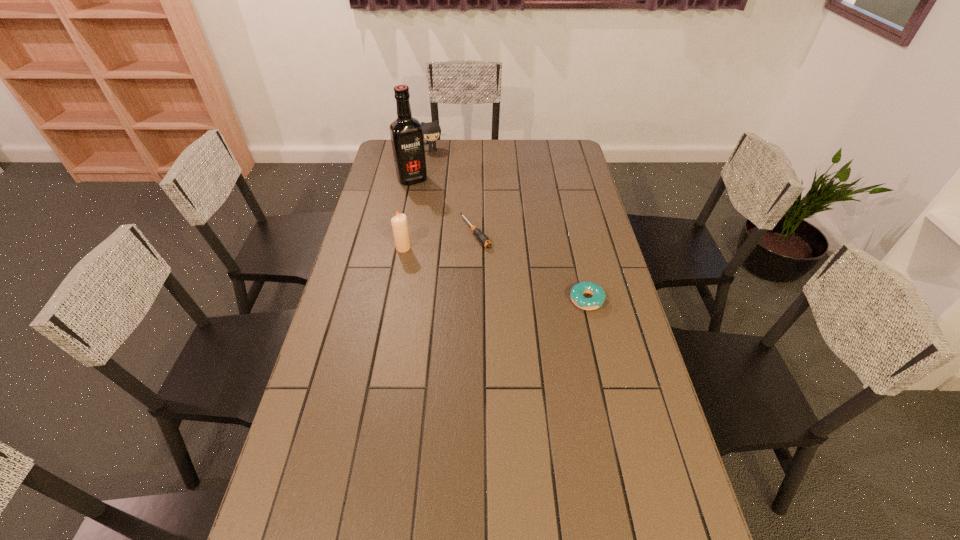
This screenshot has width=960, height=540. I want to click on free point located on the front-facing side of the kitten, so click(x=448, y=184).

Locate an element on the screen. The height and width of the screenshot is (540, 960). vacant region located on the front-facing side of the kitten is located at coordinates (442, 166).

This screenshot has width=960, height=540. Identify the location of vacant space located on the front-facing side of the kitten. (441, 165).

Where is `free point located 0.310m at the tip of the fourth object from left to right`? The height and width of the screenshot is (540, 960). free point located 0.310m at the tip of the fourth object from left to right is located at coordinates (531, 305).

Where is `vacant region located at the tip of the fourth object from left to right`? The image size is (960, 540). vacant region located at the tip of the fourth object from left to right is located at coordinates (498, 267).

Where is `vacant point located at the tip of the fourth object from left to right`? This screenshot has height=540, width=960. vacant point located at the tip of the fourth object from left to right is located at coordinates (513, 284).

Where is `free space located 0.080m on the front-facing side of the fourth nearest object`? free space located 0.080m on the front-facing side of the fourth nearest object is located at coordinates (424, 196).

This screenshot has height=540, width=960. I want to click on vacant space located 0.100m on the front-facing side of the fourth nearest object, so (426, 198).

The width and height of the screenshot is (960, 540). In order to click on vacant space located 0.150m on the front-facing side of the fourth nearest object in this screenshot , I will do click(430, 205).

At what (x,y) coordinates should I click in order to perform the action: click on object at the far edge. Please return your answer as a coordinate pair (x, y). Looking at the image, I should click on (431, 131).